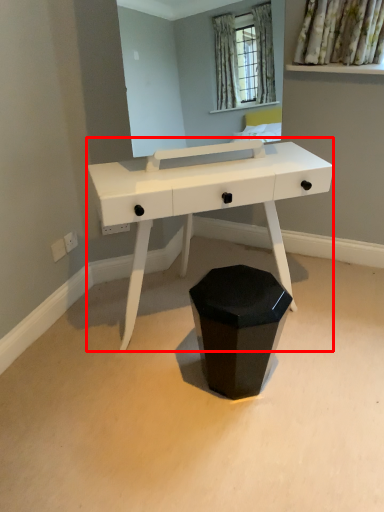
Question: Where is table (annotated by the red box) located in relation to waste container in the image?

Choices:
 (A) right
 (B) left

Answer: (B)